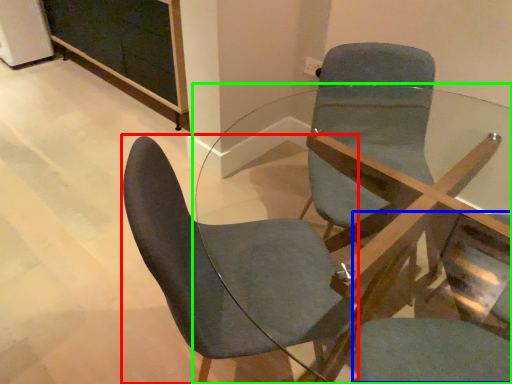
Question: Estimate the real-world distances between objects in this image. Which object is farther from chair (highlighted by a red box), swivel chair (highlighted by a blue box) or table (highlighted by a green box)?

Choices:
 (A) swivel chair
 (B) table

Answer: (A)